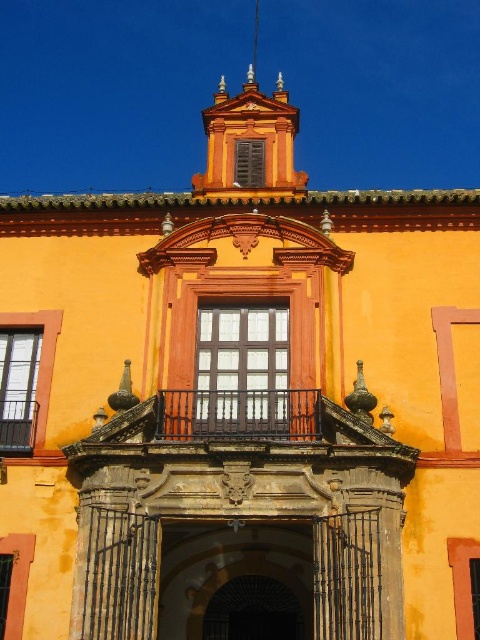
You are an architect designing a new building inspired by Spanish colonial style. You have to decide whether to place a decorative element above or below the dark brick archway at center and black wrought iron balcony at upper center. Based on their sizes, where should the decorative element be placed?

The dark brick archway at center is bigger than the black wrought iron balcony at upper center, so the decorative element should be placed above the dark brick archway at center to maintain visual balance.

From the picture: You are an architect designing a new building and want to incorporate elements from this Spanish colonial facade. You have a dark brick archway at center and a black wrought iron balcony at upper center in your design. Which element should you place higher up on the building to maintain the original proportions?

The dark brick archway at center is taller than the black wrought iron balcony at upper center, so to maintain the original proportions, the dark brick archway at center should be placed higher up on the building than the black wrought iron balcony at upper center.

You are a painter who wants to paint both the golden ornate gate at center and the black wrought iron balcony at upper center. Which object requires more paint in terms of width?

The golden ornate gate at center requires more paint in terms of width because its width surpasses that of the black wrought iron balcony at upper center.